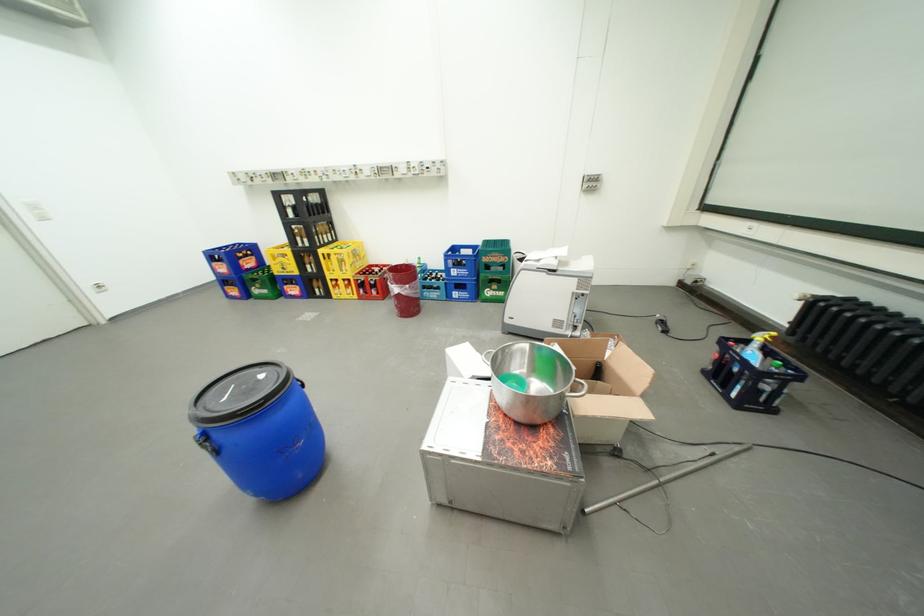
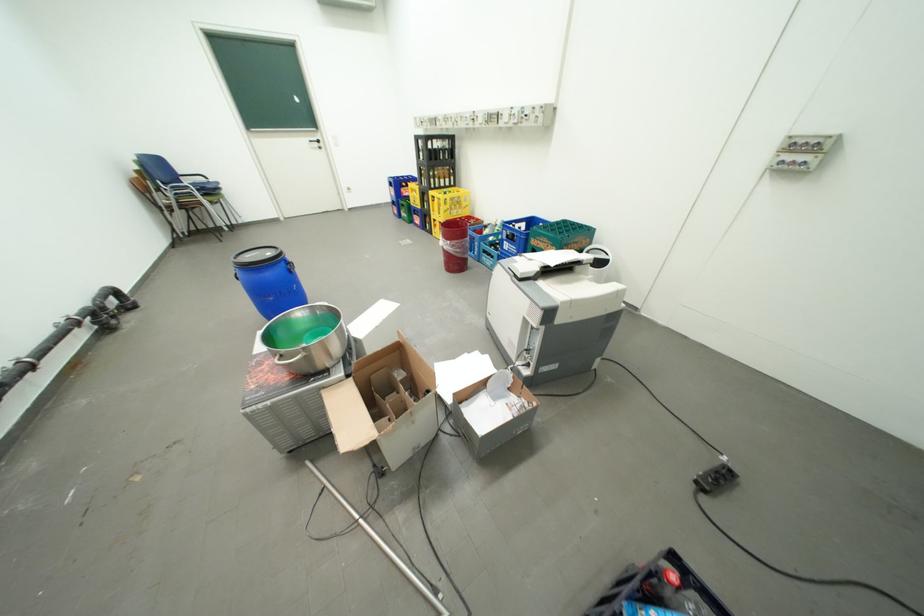
Where in the second image is the point corresponding to point 418,286 from the first image?

(459, 243)